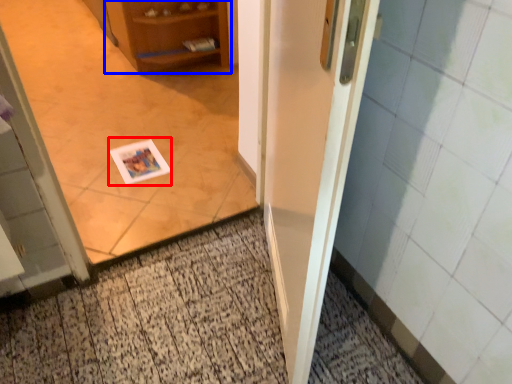
Question: Which of the following is the farthest to the observer, postcard (highlighted by a red box) or cabinetry (highlighted by a blue box)?

Choices:
 (A) postcard
 (B) cabinetry

Answer: (B)